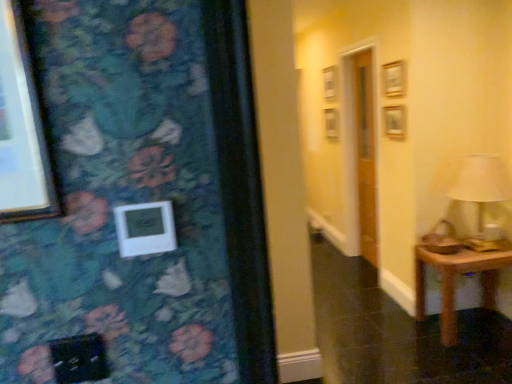
The height and width of the screenshot is (384, 512). In order to click on white fabric lampshade at right in this screenshot , I will do `click(478, 183)`.

Which is more to the right, white fabric lampshade at right or white plastic picture frame at center?

Positioned to the right is white fabric lampshade at right.

Does white fabric lampshade at right turn towards white plastic picture frame at center?

No.

From the image's perspective, is white fabric lampshade at right located above white plastic picture frame at center?

No, from the image's perspective, white fabric lampshade at right is not over white plastic picture frame at center.

Who is more distant, white fabric lampshade at right or white plastic picture frame at center?

white fabric lampshade at right is behind.

What's the angular difference between white plastic picture frame at center and brown wooden table at lower right's facing directions?

The angular difference between white plastic picture frame at center and brown wooden table at lower right is 2.54 degrees.

From the image's perspective, who appears lower, white plastic picture frame at center or brown wooden table at lower right?

brown wooden table at lower right appears lower in the image.

In the scene shown: Between white plastic picture frame at center and brown wooden table at lower right, which one is positioned behind?

brown wooden table at lower right is behind.

Where is `table below the white plastic picture frame at center (from the image's perspective)`? table below the white plastic picture frame at center (from the image's perspective) is located at coordinates (455, 280).

Image resolution: width=512 pixels, height=384 pixels. I want to click on picture frame on the left side of white fabric lampshade at right, so pos(145,228).

How different are the orientations of white plastic picture frame at center and white fabric lampshade at right in degrees?

The facing directions of white plastic picture frame at center and white fabric lampshade at right are 2.54 degrees apart.

From the image's perspective, would you say white plastic picture frame at center is shown under white fabric lampshade at right?

No.

Does white plastic picture frame at center appear on the right side of white fabric lampshade at right?

Incorrect, white plastic picture frame at center is not on the right side of white fabric lampshade at right.

Looking at this image, considering the sizes of objects white fabric lampshade at right and brown wooden table at lower right in the image provided, who is shorter, white fabric lampshade at right or brown wooden table at lower right?

brown wooden table at lower right.

Is white fabric lampshade at right facing towards brown wooden table at lower right?

No.

Which is more to the left, white fabric lampshade at right or brown wooden table at lower right?

white fabric lampshade at right is more to the left.

Is brown wooden table at lower right smaller than white plastic picture frame at center?

Actually, brown wooden table at lower right might be larger than white plastic picture frame at center.

From a real-world perspective, is brown wooden table at lower right positioned above or below white plastic picture frame at center?

From a real-world perspective, brown wooden table at lower right is physically below white plastic picture frame at center.

From the image's perspective, which is below, brown wooden table at lower right or white plastic picture frame at center?

brown wooden table at lower right.

Considering the points (443, 315) and (488, 175), which point is behind, point (443, 315) or point (488, 175)?

The point (443, 315) is farther from the camera.

Is brown wooden table at lower right inside or outside of white fabric lampshade at right?

brown wooden table at lower right is located beyond the bounds of white fabric lampshade at right.

Does brown wooden table at lower right have a greater height compared to white fabric lampshade at right?

Incorrect, the height of brown wooden table at lower right is not larger of that of white fabric lampshade at right.

Consider the image. Does brown wooden table at lower right have a lesser width compared to white fabric lampshade at right?

Incorrect, the width of brown wooden table at lower right is not less than that of white fabric lampshade at right.

In the image, there is a white fabric lampshade at right. Identify the location of picture frame above it (from the image's perspective). This screenshot has height=384, width=512. (145, 228).

You are a GUI agent. You are given a task and a screenshot of the screen. Output one action in this format:
    pyautogui.click(x=<x>, y=<y>)
    Task: Click on the table below the white plastic picture frame at center (from a real-world perspective)
    
    Given the screenshot: What is the action you would take?
    [455, 280]

When comparing their distances from brown wooden table at lower right, does white plastic picture frame at center or white fabric lampshade at right seem further?

The object further to brown wooden table at lower right is white plastic picture frame at center.

Based on their spatial positions, is brown wooden table at lower right or white plastic picture frame at center further from white fabric lampshade at right?

white plastic picture frame at center is positioned further to the anchor white fabric lampshade at right.

When comparing their distances from brown wooden table at lower right, does white fabric lampshade at right or white plastic picture frame at center seem closer?

Based on the image, white fabric lampshade at right appears to be nearer to brown wooden table at lower right.

From the image, which object appears to be nearer to white plastic picture frame at center, white fabric lampshade at right or brown wooden table at lower right?

Among the two, brown wooden table at lower right is located nearer to white plastic picture frame at center.

From the image, which object appears to be farther from white fabric lampshade at right, white plastic picture frame at center or brown wooden table at lower right?

Based on the image, white plastic picture frame at center appears to be further to white fabric lampshade at right.

When comparing their distances from white plastic picture frame at center, does brown wooden table at lower right or white fabric lampshade at right seem closer?

brown wooden table at lower right lies closer to white plastic picture frame at center than the other object.

Where is `table lamp located between white plastic picture frame at center and brown wooden table at lower right in the depth direction`? table lamp located between white plastic picture frame at center and brown wooden table at lower right in the depth direction is located at coordinates (478, 183).